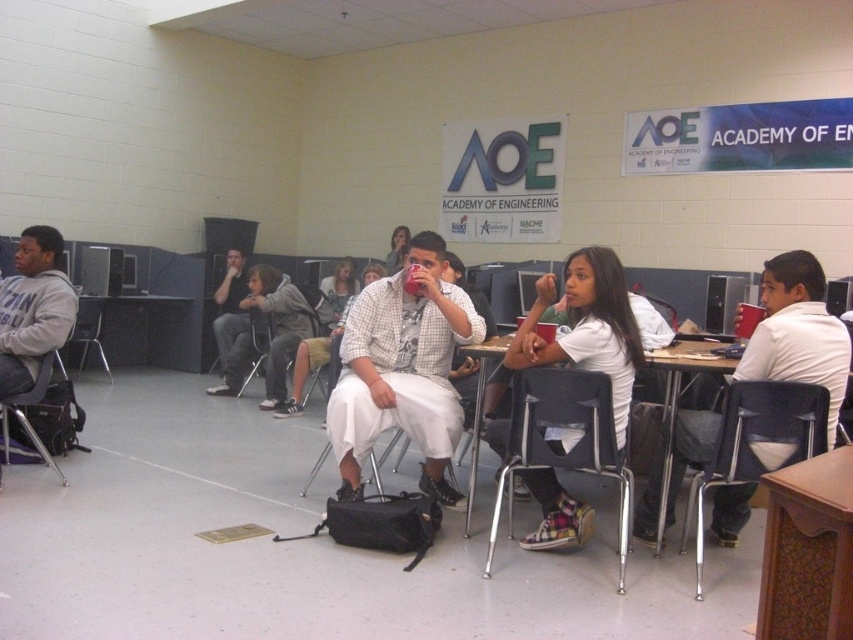
In the classroom scene at the Academy of Engineering, you see a metallic silver chair at left and a metallic gray chair at left. Which chair is closer to the right side of the room?

The metallic silver chair at left is positioned on the right side of the metallic gray chair at left, so it is closer to the right side of the room.

You are standing at the front of the classroom and want to move towards the metallic gray chair at lower right and the metallic gray chair at center. Which chair should you approach first to reach the one closer to you?

You should approach the metallic gray chair at lower right first because it is closer to you than the metallic gray chair at center.